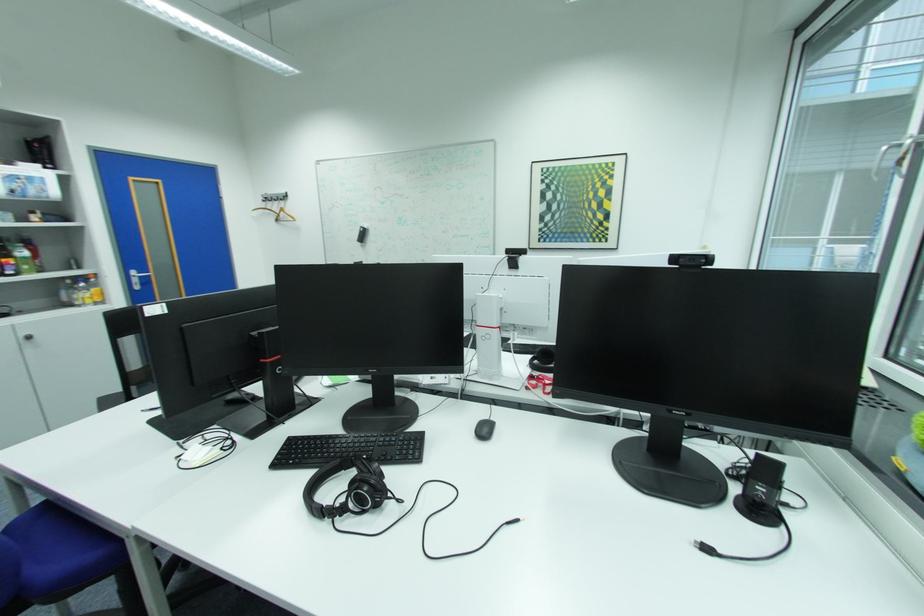
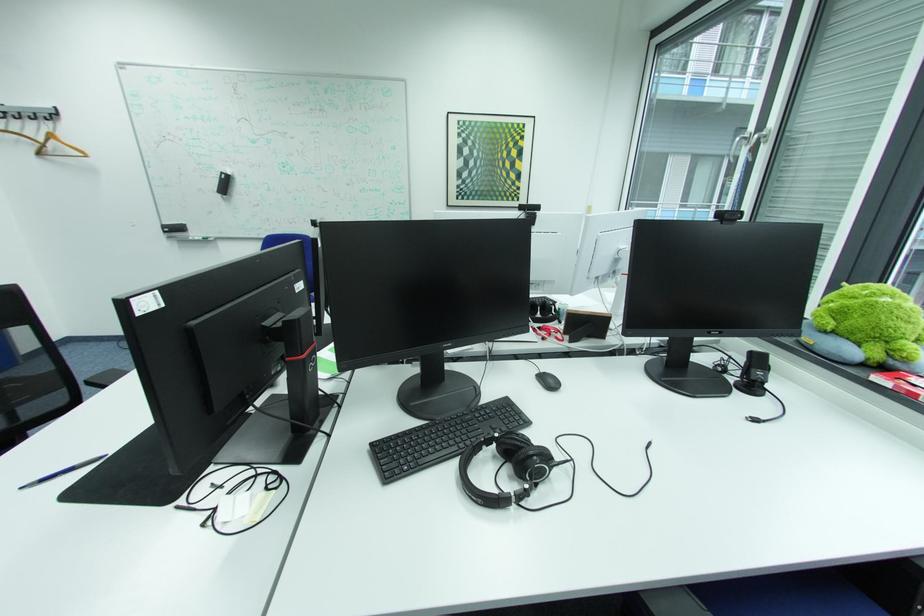
The point at (x=543, y=387) is marked in the first image. Where is the corresponding point in the second image?

(558, 337)